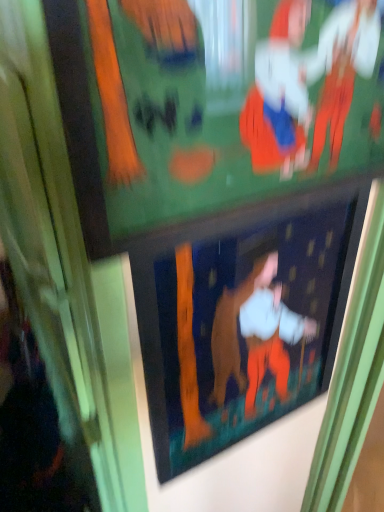
The width and height of the screenshot is (384, 512). What do you see at coordinates (214, 111) in the screenshot?
I see `matte green bulletin board at upper center` at bounding box center [214, 111].

In order to click on matte green bulletin board at upper center in this screenshot , I will do `click(214, 111)`.

What do you see at coordinates (241, 329) in the screenshot? I see `matte black picture frame at center` at bounding box center [241, 329].

The height and width of the screenshot is (512, 384). In order to click on matte black picture frame at center in this screenshot , I will do click(x=241, y=329).

Measure the distance between point (234, 375) and camera.

They are 66.60 centimeters apart.

At what (x,y) coordinates should I click in order to perform the action: click on matte green bulletin board at upper center. Please return your answer as a coordinate pair (x, y). This screenshot has width=384, height=512. Looking at the image, I should click on tap(214, 111).

Based on their positions, is matte green bulletin board at upper center located to the left or right of matte black picture frame at center?

matte green bulletin board at upper center is positioned on matte black picture frame at center's left side.

Which is in front, matte green bulletin board at upper center or matte black picture frame at center?

matte green bulletin board at upper center is in front.

Does point (128, 11) appear closer or farther from the camera than point (192, 332)?

Point (128, 11) appears to be closer to the viewer than point (192, 332).

From the image's perspective, is matte green bulletin board at upper center below matte black picture frame at center?

No, from the image's perspective, matte green bulletin board at upper center is not below matte black picture frame at center.

From a real-world perspective, between matte green bulletin board at upper center and matte black picture frame at center, who is vertically lower?

From a 3D spatial view, matte black picture frame at center is below.

Considering the sizes of objects matte green bulletin board at upper center and matte black picture frame at center in the image provided, who is thinner, matte green bulletin board at upper center or matte black picture frame at center?

matte black picture frame at center.

In terms of height, does matte green bulletin board at upper center look taller or shorter compared to matte black picture frame at center?

Considering their sizes, matte green bulletin board at upper center has less height than matte black picture frame at center.

Is matte green bulletin board at upper center smaller than matte black picture frame at center?

No, matte green bulletin board at upper center is not smaller than matte black picture frame at center.

Consider the image. Is matte green bulletin board at upper center located outside matte black picture frame at center?

matte green bulletin board at upper center lies outside matte black picture frame at center's area.

Would you consider matte green bulletin board at upper center to be distant from matte black picture frame at center?

No, there isn't a large distance between matte green bulletin board at upper center and matte black picture frame at center.

Is matte green bulletin board at upper center looking in the opposite direction of matte black picture frame at center?

matte green bulletin board at upper center is not turned away from matte black picture frame at center.

Consider the image. What's the angular difference between matte green bulletin board at upper center and matte black picture frame at center's facing directions?

They differ by 2.13 degrees in their facing directions.

At what (x,y) coordinates should I click in order to perform the action: click on bulletin board located in front of the matte black picture frame at center. Please return your answer as a coordinate pair (x, y). Looking at the image, I should click on (214, 111).

Between matte black picture frame at center and matte green bulletin board at upper center, which one appears on the right side from the viewer's perspective?

From the viewer's perspective, matte black picture frame at center appears more on the right side.

Which object is further away from the camera, matte black picture frame at center or matte green bulletin board at upper center?

Positioned behind is matte black picture frame at center.

Does point (268, 262) appear closer or farther from the camera than point (166, 70)?

Point (268, 262) is positioned farther from the camera compared to point (166, 70).

From the image's perspective, is matte black picture frame at center under matte green bulletin board at upper center?

Yes.

From a real-world perspective, which is physically below, matte black picture frame at center or matte green bulletin board at upper center?

From a 3D spatial view, matte black picture frame at center is below.

Is matte black picture frame at center thinner than matte green bulletin board at upper center?

Indeed, matte black picture frame at center has a lesser width compared to matte green bulletin board at upper center.

Considering the sizes of objects matte black picture frame at center and matte green bulletin board at upper center in the image provided, who is taller, matte black picture frame at center or matte green bulletin board at upper center?

Standing taller between the two is matte black picture frame at center.

Considering the sizes of matte black picture frame at center and matte green bulletin board at upper center in the image, is matte black picture frame at center bigger or smaller than matte green bulletin board at upper center?

In the image, matte black picture frame at center appears to be smaller than matte green bulletin board at upper center.

Is matte black picture frame at center not inside matte green bulletin board at upper center?

That's correct, matte black picture frame at center is outside of matte green bulletin board at upper center.

Are matte black picture frame at center and matte green bulletin board at upper center beside each other?

No, matte black picture frame at center is not beside matte green bulletin board at upper center.

Is matte black picture frame at center facing towards matte green bulletin board at upper center?

No, matte black picture frame at center is not oriented towards matte green bulletin board at upper center.

Can you tell me how much matte black picture frame at center and matte green bulletin board at upper center differ in facing direction?

2.13 degrees separate the facing orientations of matte black picture frame at center and matte green bulletin board at upper center.

Where is `picture frame located on the right of matte green bulletin board at upper center`? picture frame located on the right of matte green bulletin board at upper center is located at coordinates (241, 329).

At what (x,y) coordinates should I click in order to perform the action: click on picture frame on the right of matte green bulletin board at upper center. Please return your answer as a coordinate pair (x, y). Image resolution: width=384 pixels, height=512 pixels. Looking at the image, I should click on (241, 329).

Image resolution: width=384 pixels, height=512 pixels. Find the location of `picture frame below the matte green bulletin board at upper center (from the image's perspective)`. picture frame below the matte green bulletin board at upper center (from the image's perspective) is located at coordinates (241, 329).